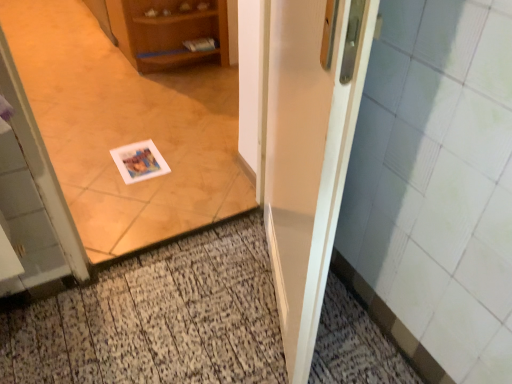
I want to click on free space in front of wooden cabinet at upper left, so click(x=119, y=109).